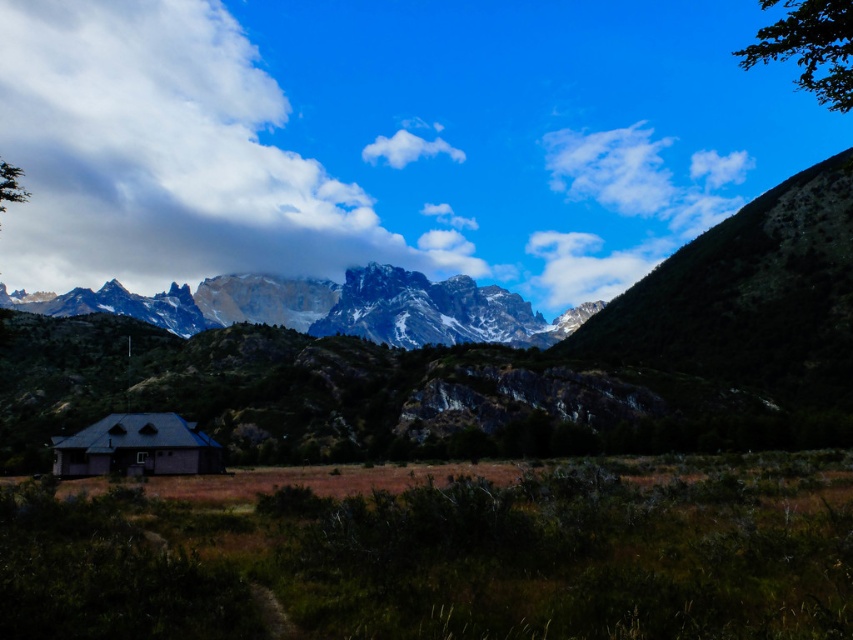
Question: Can you confirm if cloudy white at upper center is positioned above white fluffy cloud at upper center?

Choices:
 (A) yes
 (B) no

Answer: (B)

Question: Estimate the real-world distances between objects in this image. Which object is closer to the cloudy white at upper center?

Choices:
 (A) white fluffy cloud at upper center
 (B) gray wooden cabin at lower left

Answer: (A)

Question: Does cloudy white at upper center appear on the right side of green leafy tree at upper right?

Choices:
 (A) no
 (B) yes

Answer: (A)

Question: Does cloudy white at upper center have a larger size compared to green leafy tree at upper right?

Choices:
 (A) yes
 (B) no

Answer: (B)

Question: Among these points, which one is nearest to the camera?

Choices:
 (A) (759, 36)
 (B) (416, 147)
 (C) (74, 108)

Answer: (B)

Question: Which of the following is the farthest from the observer?

Choices:
 (A) white fluffy cloud at upper center
 (B) green leafy tree at upper right
 (C) gray wooden cabin at lower left
 (D) cloudy white at upper center

Answer: (A)